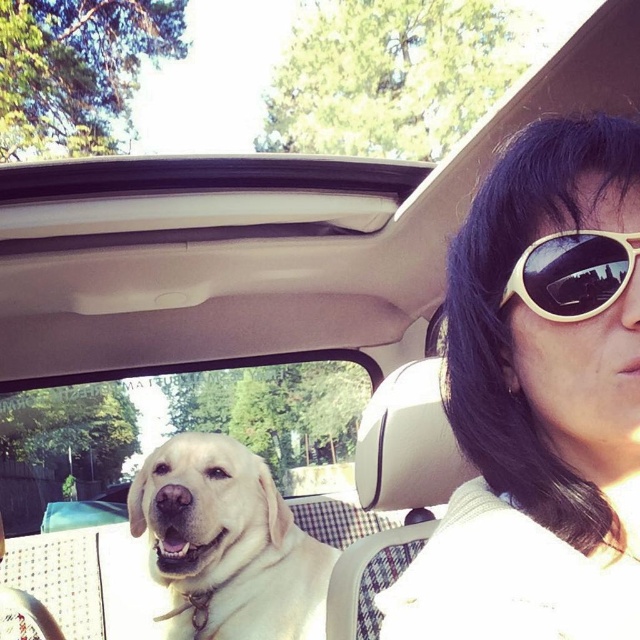
You are sitting in the car and want to reach both points marked in the scene. Which point, point (148, 429) or point (604, 284), is closer to you?

Point (148, 429) is closer to you because it is further to the viewer than point (604, 284).

You are a passenger in the car and want to look at the clear glass window at center without moving your head. Can you see the reflection of the golden Labrador Retriever in the white matte sunglasses at upper right?

The white matte sunglasses at upper right is above the clear glass window at center, so the reflection of the golden Labrador Retriever may be visible in the sunglasses if the angle allows.